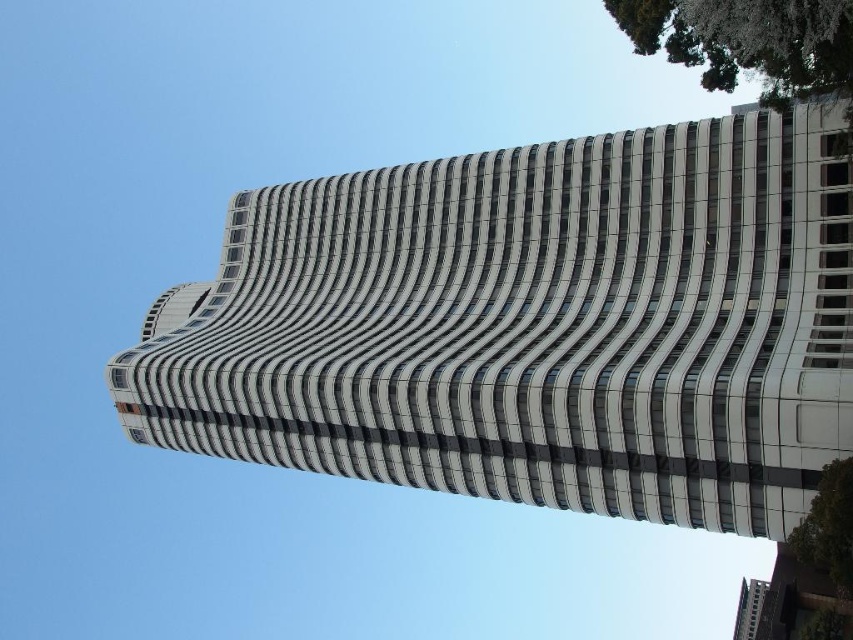
From the picture: Can you confirm if green leafy tree at upper right is thinner than green leafy tree at lower right?

No, green leafy tree at upper right is not thinner than green leafy tree at lower right.

Who is more forward, (845, 35) or (837, 577)?

Point (845, 35) is more forward.

What are the coordinates of `green leafy tree at upper right` in the screenshot? It's located at (749, 42).

Which is below, white smooth building at center or green leafy tree at lower right?

green leafy tree at lower right is below.

Which is above, white smooth building at center or green leafy tree at lower right?

Positioned higher is white smooth building at center.

What do you see at coordinates (534, 324) in the screenshot? This screenshot has width=853, height=640. I see `white smooth building at center` at bounding box center [534, 324].

Locate an element on the screen. The image size is (853, 640). white smooth building at center is located at coordinates (534, 324).

Which is more to the left, white smooth building at center or green leafy tree at upper right?

white smooth building at center is more to the left.

Can you confirm if white smooth building at center is smaller than green leafy tree at upper right?

Incorrect, white smooth building at center is not smaller in size than green leafy tree at upper right.

The image size is (853, 640). I want to click on white smooth building at center, so click(534, 324).